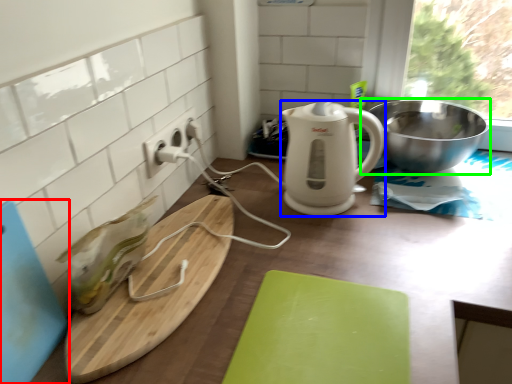
Question: Estimate the real-world distances between objects in this image. Which object is farther from cutting board (highlighted by a red box), kitchen appliance (highlighted by a blue box) or bowl (highlighted by a green box)?

Choices:
 (A) kitchen appliance
 (B) bowl

Answer: (B)